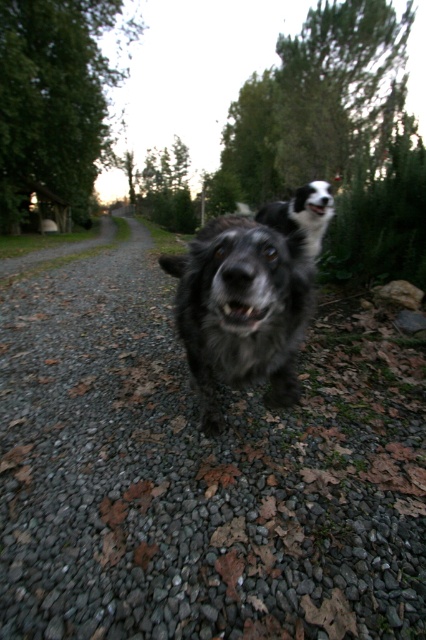
Question: Observing the image, what is the correct spatial positioning of gray gravel at center in reference to black fur dog at center?

Choices:
 (A) below
 (B) above

Answer: (A)

Question: Which point is closer to the camera taking this photo?

Choices:
 (A) (422, 292)
 (B) (51, 317)

Answer: (A)

Question: Which point appears farthest from the camera in this image?

Choices:
 (A) pos(310,342)
 (B) pos(58,257)
 (C) pos(261,346)
 (D) pos(403,298)

Answer: (B)

Question: Does green leafy tree at upper center have a larger size compared to black fur dog at center?

Choices:
 (A) yes
 (B) no

Answer: (A)

Question: Which point is closer to the camera?

Choices:
 (A) gray gravel at center
 (B) fuzzy black dog at center
 (C) green leafy tree at upper center

Answer: (B)

Question: Does gray gravel at center appear over green leafy tree at upper left?

Choices:
 (A) no
 (B) yes

Answer: (A)